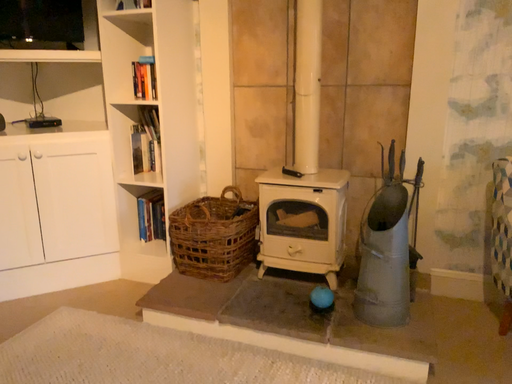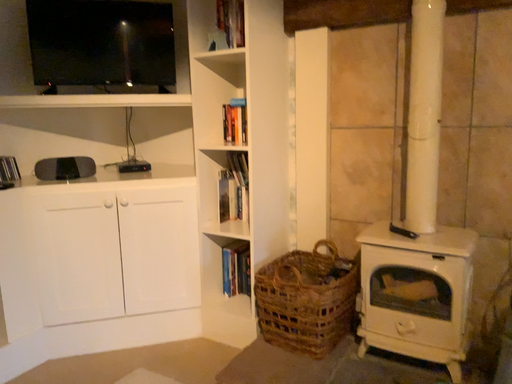
Question: How did the camera likely rotate when shooting the video?

Choices:
 (A) rotated right
 (B) rotated left

Answer: (B)